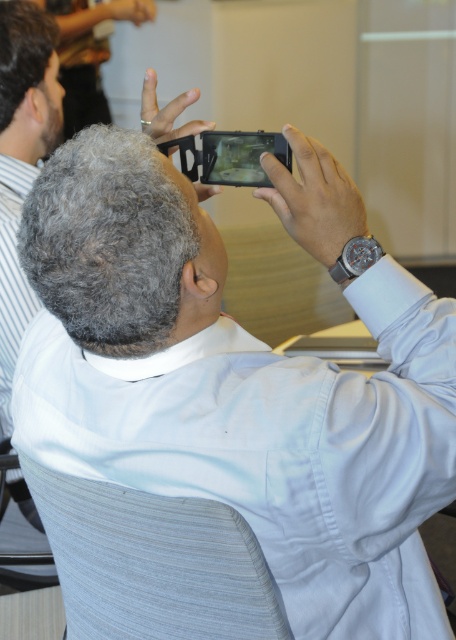
Question: Can you confirm if light gray woven fabric chair at lower center is wider than satin silver watch at upper right?

Choices:
 (A) yes
 (B) no

Answer: (A)

Question: Which point is farther to the camera?

Choices:
 (A) light gray woven fabric chair at lower center
 (B) satin silver watch at upper right

Answer: (B)

Question: Can you confirm if light gray woven fabric chair at lower center is wider than satin silver watch at upper right?

Choices:
 (A) yes
 (B) no

Answer: (A)

Question: Which point is closer to the camera?

Choices:
 (A) (357, 275)
 (B) (57, 516)

Answer: (A)

Question: Can you confirm if light gray woven fabric chair at lower center is bigger than satin silver watch at upper right?

Choices:
 (A) no
 (B) yes

Answer: (B)